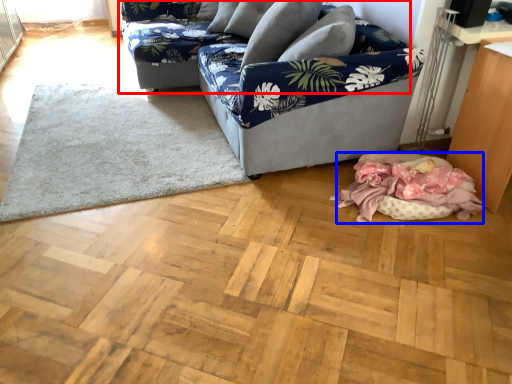
Question: Which point is further to the camera, studio couch (highlighted by a red box) or blanket (highlighted by a blue box)?

Choices:
 (A) studio couch
 (B) blanket

Answer: (A)